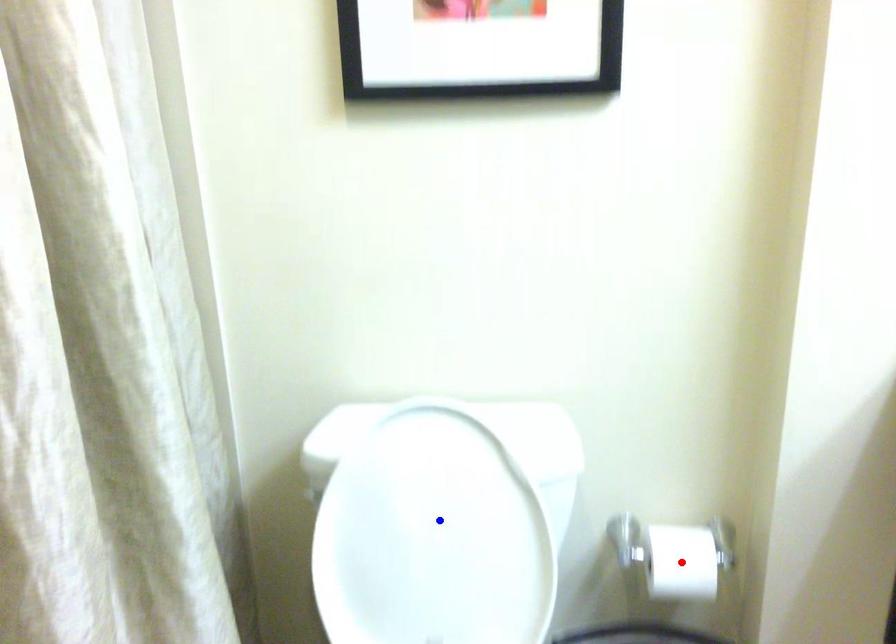
Question: Two points are marked on the image. Which point is closer to the camera?

Choices:
 (A) Blue point is closer.
 (B) Red point is closer.

Answer: (A)